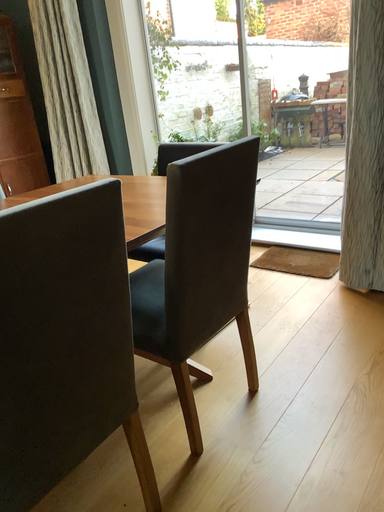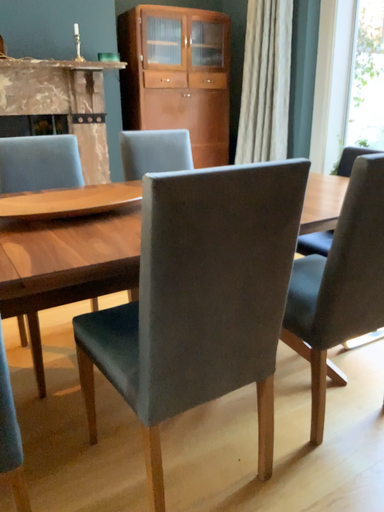
Question: Which way did the camera rotate in the video?

Choices:
 (A) rotated right
 (B) rotated left

Answer: (B)